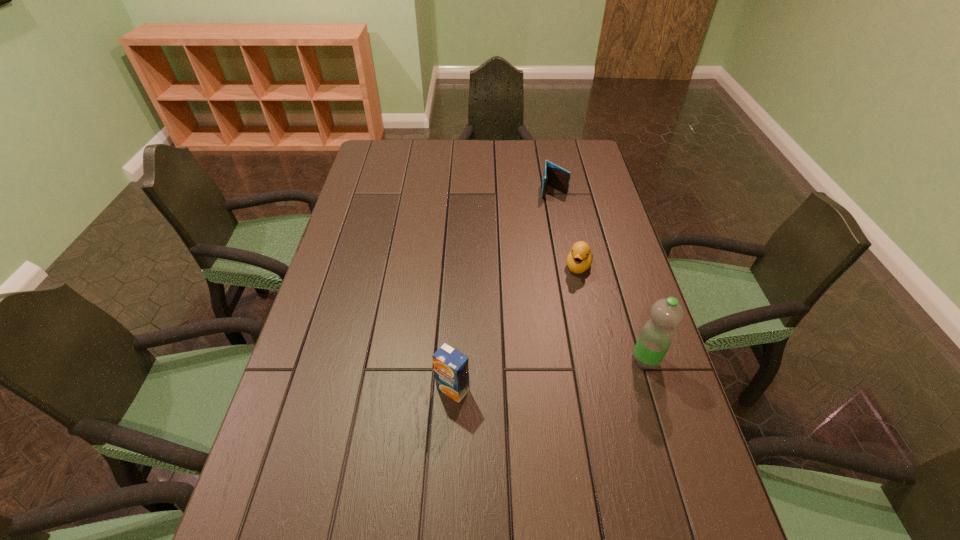
In the image, there is a desktop. Where is `blank space at the right edge`? blank space at the right edge is located at coordinates (624, 416).

At what (x,y) coordinates should I click in order to perform the action: click on vacant point at the far left corner. Please return your answer as a coordinate pair (x, y). The height and width of the screenshot is (540, 960). Looking at the image, I should click on (392, 150).

Where is `free space between the farthest object and the duckling`? free space between the farthest object and the duckling is located at coordinates (566, 228).

Locate an element on the screen. free space between the second farthest object and the wallet is located at coordinates (566, 228).

This screenshot has width=960, height=540. Find the location of `unoccupied area between the duckling and the water bottle`. unoccupied area between the duckling and the water bottle is located at coordinates (612, 313).

At what (x,y) coordinates should I click in order to perform the action: click on vacant region between the nearest object and the farthest object. Please return your answer as a coordinate pair (x, y). This screenshot has height=540, width=960. Looking at the image, I should click on (503, 290).

The height and width of the screenshot is (540, 960). Identify the location of free spot between the duckling and the leftmost object. (516, 327).

The width and height of the screenshot is (960, 540). Identify the location of free space between the second nearest object and the wallet. (600, 275).

I want to click on free spot between the wallet and the rightmost object, so click(x=600, y=275).

Locate an element on the screen. This screenshot has width=960, height=540. vacant area that lies between the farthest object and the second farthest object is located at coordinates (566, 228).